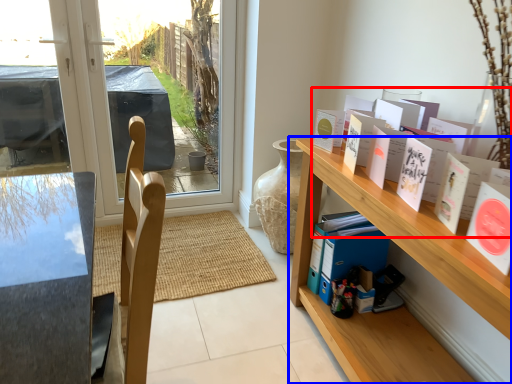
Question: Which of the following is the closest to the observer, book (highlighted by a red box) or shelf (highlighted by a blue box)?

Choices:
 (A) book
 (B) shelf

Answer: (A)